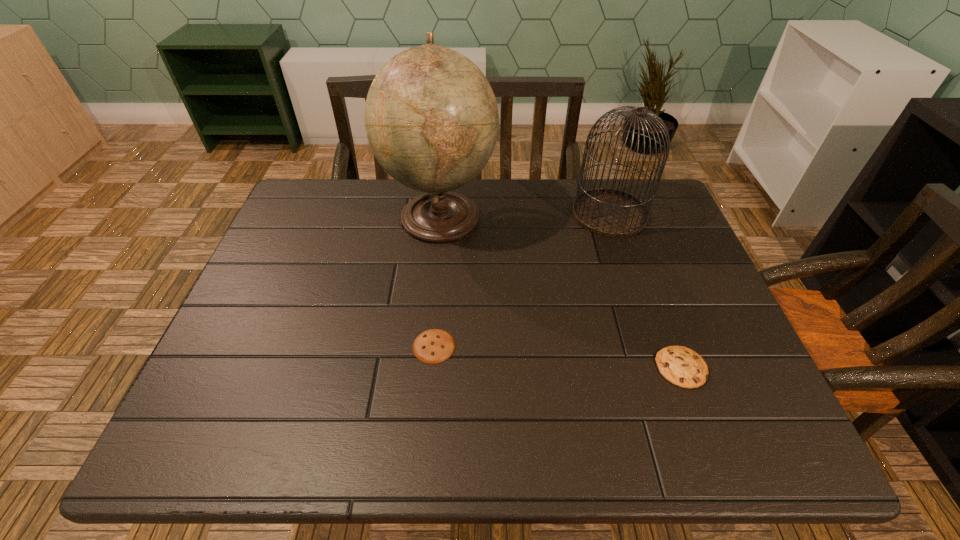
Locate an element on the screen. The height and width of the screenshot is (540, 960). globe at the far edge is located at coordinates [431, 117].

Locate an element on the screen. This screenshot has width=960, height=540. birdcage located in the far edge section of the desktop is located at coordinates (611, 213).

At what (x,y) coordinates should I click in order to perform the action: click on birdcage at the right edge. Please return your answer as a coordinate pair (x, y). Looking at the image, I should click on (611, 213).

Find the location of a particular element. This screenshot has width=960, height=540. cookie present at the right edge is located at coordinates (681, 366).

At what (x,y) coordinates should I click in order to perform the action: click on object present at the far right corner. Please return your answer as a coordinate pair (x, y). Looking at the image, I should click on [611, 213].

Where is `vacant space at the far edge`? vacant space at the far edge is located at coordinates (550, 225).

You are a GUI agent. You are given a task and a screenshot of the screen. Output one action in this format:
    pyautogui.click(x=<x>, y=<y>)
    Task: Click on the vacant region at the near edge of the desktop
    The height and width of the screenshot is (540, 960).
    Given the screenshot: What is the action you would take?
    pyautogui.click(x=441, y=427)

In the image, there is a desktop. Where is `free region at the left edge`? This screenshot has height=540, width=960. free region at the left edge is located at coordinates (321, 229).

The width and height of the screenshot is (960, 540). Find the location of `free space at the right edge`. free space at the right edge is located at coordinates 661,286.

The image size is (960, 540). In order to click on vacant space at the far left corner of the desktop in this screenshot , I will do `click(333, 195)`.